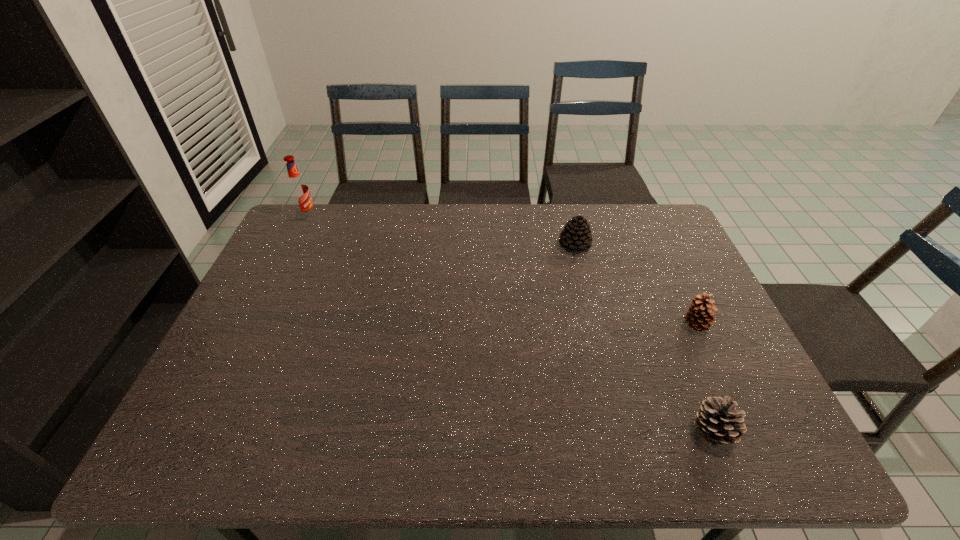
The width and height of the screenshot is (960, 540). I want to click on vacant area that lies between the second farthest pinecone and the second farthest object, so click(635, 286).

Identify which object is the second nearest to the nearest object. Please provide its 2D coordinates. Your answer should be formatted as a tuple, i.e. [(x, y)], where the tuple contains the x and y coordinates of a point satisfying the conditions above.

[(576, 236)]

Where is `object that ranks as the closest to the third farthest object`? object that ranks as the closest to the third farthest object is located at coordinates (717, 421).

I want to click on the second closest pinecone relative to the leftmost pinecone, so click(x=717, y=421).

Choose which pinecone is the third nearest neighbor to the tallest object. Please provide its 2D coordinates. Your answer should be formatted as a tuple, i.e. [(x, y)], where the tuple contains the x and y coordinates of a point satisfying the conditions above.

[(717, 421)]

Identify the location of free point that satisfies the following two spatial constraints: 1. at the narrow end of the third nearest object; 2. on the right side of the third farthest object. (594, 325).

Find the location of a particular element. This screenshot has height=540, width=960. free region that satisfies the following two spatial constraints: 1. at the narrow end of the second farthest pinecone; 2. on the right side of the third nearest object is located at coordinates (594, 325).

In order to click on vacant space that satisfies the following two spatial constraints: 1. at the narrow end of the nearest object; 2. on the right side of the second object from left to right in this screenshot , I will do [x=620, y=431].

This screenshot has width=960, height=540. Identify the location of vacant space that satisfies the following two spatial constraints: 1. at the narrow end of the second nearest pinecone; 2. on the left side of the leftmost pinecone. (594, 325).

You are a GUI agent. You are given a task and a screenshot of the screen. Output one action in this format:
    pyautogui.click(x=<x>, y=<y>)
    Task: Click on the vacant space that satisfies the following two spatial constraints: 1. at the narrow end of the nearest pinecone; 2. on the left side of the second farthest object
    This screenshot has width=960, height=540.
    Given the screenshot: What is the action you would take?
    pyautogui.click(x=620, y=431)